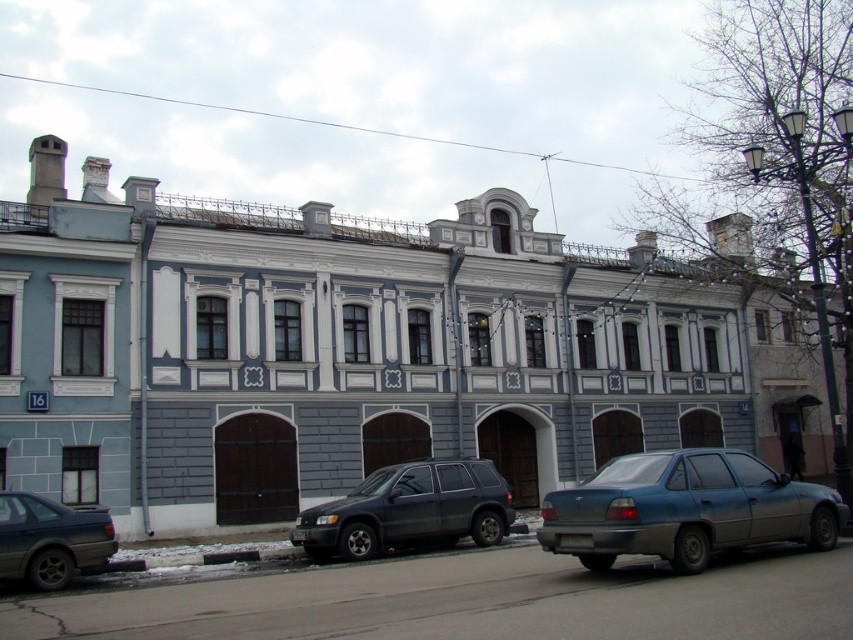
Question: Is matte dark gray suv at center closer to the viewer compared to matte black sedan at lower left?

Choices:
 (A) yes
 (B) no

Answer: (B)

Question: Can you confirm if matte dark gray suv at center is smaller than matte black sedan at lower left?

Choices:
 (A) yes
 (B) no

Answer: (B)

Question: Does matte dark gray suv at center have a larger size compared to matte black sedan at lower left?

Choices:
 (A) no
 (B) yes

Answer: (B)

Question: Among these points, which one is farthest from the camera?

Choices:
 (A) (314, 506)
 (B) (27, 577)
 (C) (683, 544)

Answer: (A)

Question: Which point is closer to the camera?

Choices:
 (A) (619, 497)
 (B) (335, 545)

Answer: (A)

Question: Which object is the closest to the matte dark gray suv at center?

Choices:
 (A) matte black sedan at lower left
 (B) metallic gray sedan at lower right

Answer: (A)